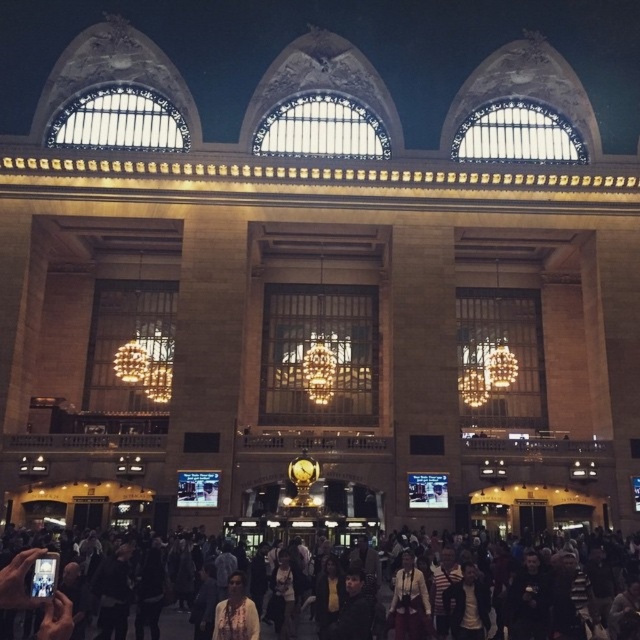
Question: Does multicolored clothing at lower center appear over white textured shirt at center?

Choices:
 (A) no
 (B) yes

Answer: (A)

Question: Is multicolored clothing at lower center wider than white textured shirt at center?

Choices:
 (A) no
 (B) yes

Answer: (B)

Question: Which point is farther to the camera?

Choices:
 (A) white textured shirt at center
 (B) multicolored clothing at lower center

Answer: (A)

Question: Does multicolored clothing at lower center have a smaller size compared to white textured shirt at center?

Choices:
 (A) no
 (B) yes

Answer: (A)